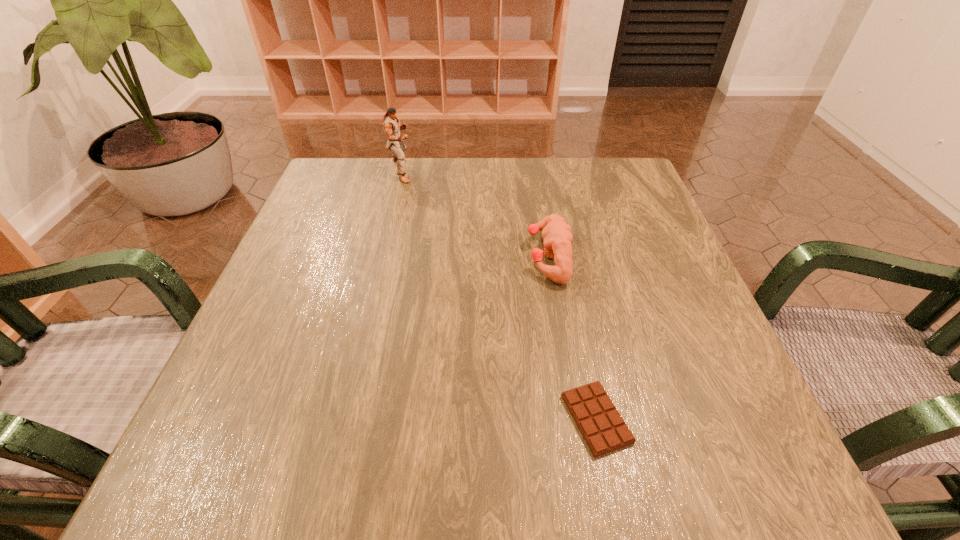
At what (x,y) coordinates should I click in order to perform the action: click on vacant area that lies between the nearer puncher and the tallest object. Please return your answer as a coordinate pair (x, y). Looking at the image, I should click on coord(475,213).

Find the location of a particular element. The height and width of the screenshot is (540, 960). empty space that is in between the left puncher and the second tallest object is located at coordinates point(475,213).

Image resolution: width=960 pixels, height=540 pixels. Find the location of `free space between the nearest object and the nearer puncher`. free space between the nearest object and the nearer puncher is located at coordinates (572, 338).

This screenshot has height=540, width=960. What are the coordinates of `free space between the shortest object and the shorter puncher` in the screenshot? It's located at (572, 338).

Where is `free space between the second shortest object and the shortest object`? free space between the second shortest object and the shortest object is located at coordinates (572, 338).

Identify the location of empty space between the second farthest object and the nearest object. This screenshot has width=960, height=540. (572, 338).

I want to click on free space between the candy bar and the leftmost object, so click(x=499, y=295).

This screenshot has width=960, height=540. What are the coordinates of `free space between the second farthest object and the nearest object` in the screenshot? It's located at (572, 338).

The height and width of the screenshot is (540, 960). In order to click on blank region between the shorter puncher and the farthest object in this screenshot , I will do `click(475, 213)`.

Where is `object that is the second closest to the left puncher`? Image resolution: width=960 pixels, height=540 pixels. object that is the second closest to the left puncher is located at coordinates (604, 430).